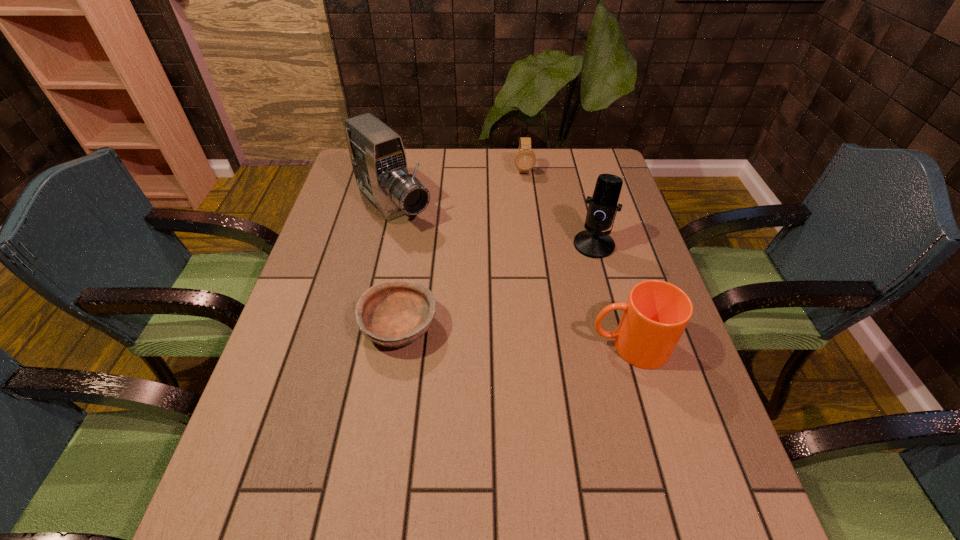
This screenshot has height=540, width=960. I want to click on the shortest object, so click(x=393, y=314).

Where is `mug`? This screenshot has width=960, height=540. mug is located at coordinates (654, 317).

At what (x,y) coordinates should I click in order to perform the action: click on the second tallest object. Please return your answer as a coordinate pair (x, y). The width and height of the screenshot is (960, 540). Looking at the image, I should click on (592, 242).

The height and width of the screenshot is (540, 960). In order to click on camcorder in this screenshot , I will do `click(378, 157)`.

Where is `the fourth tallest object`? This screenshot has height=540, width=960. the fourth tallest object is located at coordinates (525, 159).

Where is `watch`? watch is located at coordinates (525, 159).

Find the location of a particular element. The width and height of the screenshot is (960, 540). vacant space situated on the front of the shortest object is located at coordinates (383, 429).

Identify the location of free space located 0.380m on the handle side of the third shortest object. This screenshot has width=960, height=540. (421, 346).

You are a GUI agent. You are given a task and a screenshot of the screen. Output one action in this format:
    pyautogui.click(x=<x>, y=<y>)
    Task: Click on the free point located on the handle side of the third shortest object
    
    Given the screenshot: What is the action you would take?
    pyautogui.click(x=474, y=346)

I want to click on vacant space located 0.200m on the handle side of the third shortest object, so click(501, 346).